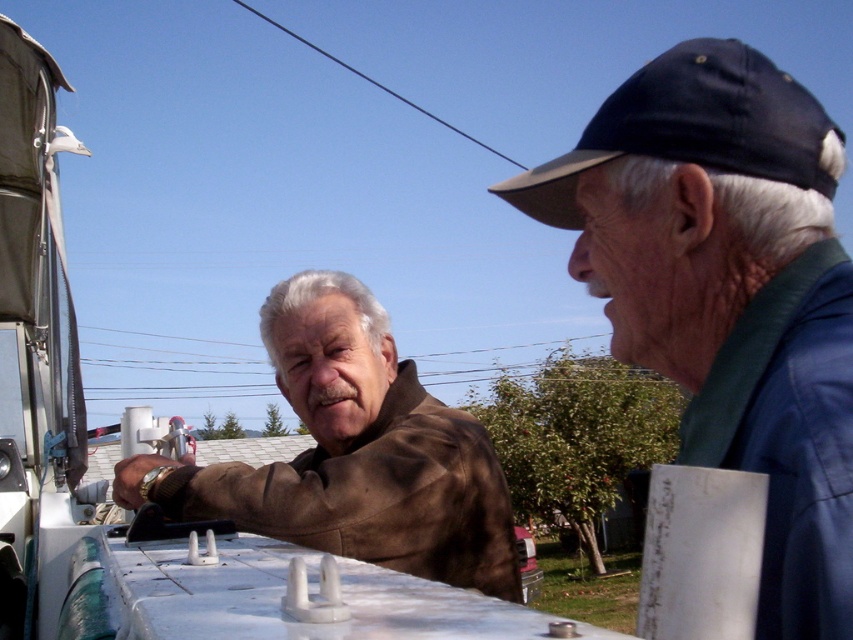
Who is more distant from viewer, (698, 360) or (556, 168)?

The point (556, 168) is more distant.

This screenshot has width=853, height=640. What are the coordinates of `blue fabric cap at upper right` in the screenshot? It's located at point(728,291).